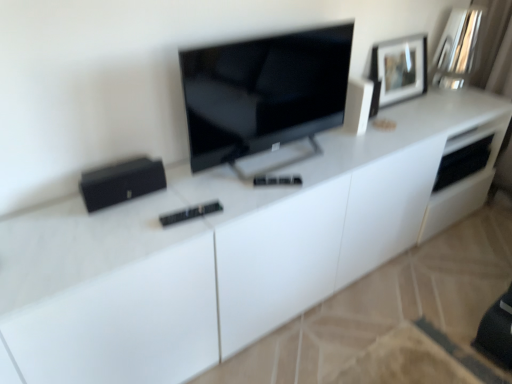
Question: Which is correct: white glossy speaker at upper right, which is counted as the 1th appliance, starting from the top, is inside black matte speaker at left, the 2th appliance viewed from the top, or outside of it?

Choices:
 (A) outside
 (B) inside

Answer: (A)

Question: From the image's perspective, is white glossy speaker at upper right, the first appliance from the right, located above or below black matte speaker at left, the 2th appliance viewed from the top?

Choices:
 (A) above
 (B) below

Answer: (A)

Question: Which object is positioned closest to the white glossy speaker at upper right, the 2th appliance from the left?

Choices:
 (A) black matte speaker at left, positioned as the first appliance in bottom-to-top order
 (B) matte black picture frame at upper right
 (C) matte black tv at center

Answer: (C)

Question: Estimate the real-world distances between objects in this image. Which object is farther from the black matte speaker at left, the 2th appliance from the right?

Choices:
 (A) white glossy speaker at upper right, which appears as the 2th appliance when ordered from the bottom
 (B) matte black tv at center
 (C) matte black picture frame at upper right

Answer: (C)